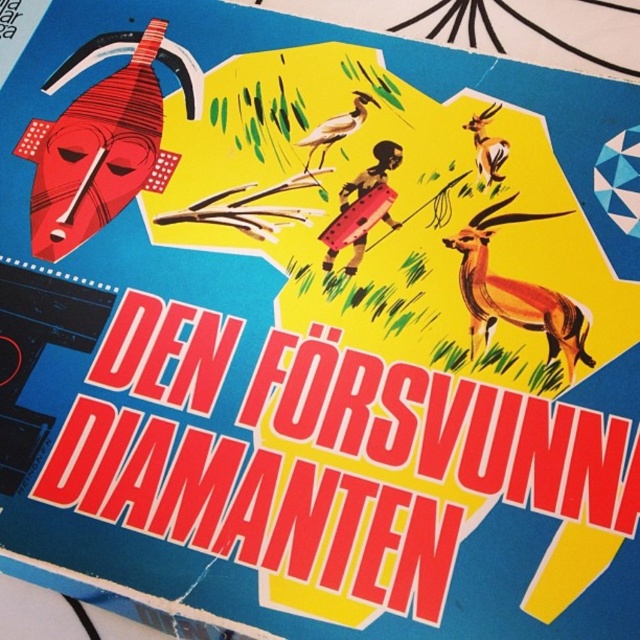
Question: Among these objects, which one is nearest to the camera?

Choices:
 (A) orange glossy antelope at center
 (B) orange glossy antelope at upper right
 (C) matte red mask at upper left
 (D) brown matte bird at center

Answer: (A)

Question: Is matte red mask at upper left below orange glossy antelope at upper right?

Choices:
 (A) no
 (B) yes

Answer: (A)

Question: Estimate the real-world distances between objects in this image. Which object is closer to the orange glossy antelope at center?

Choices:
 (A) brown matte bird at center
 (B) orange glossy antelope at upper right
 (C) matte red mask at upper left

Answer: (B)

Question: Which object appears closest to the camera in this image?

Choices:
 (A) matte red mask at upper left
 (B) orange glossy antelope at center
 (C) brown matte bird at center

Answer: (B)

Question: Does matte red mask at upper left appear under orange glossy antelope at upper right?

Choices:
 (A) yes
 (B) no

Answer: (B)

Question: Can you confirm if matte red mask at upper left is positioned to the right of orange glossy antelope at center?

Choices:
 (A) yes
 (B) no

Answer: (B)